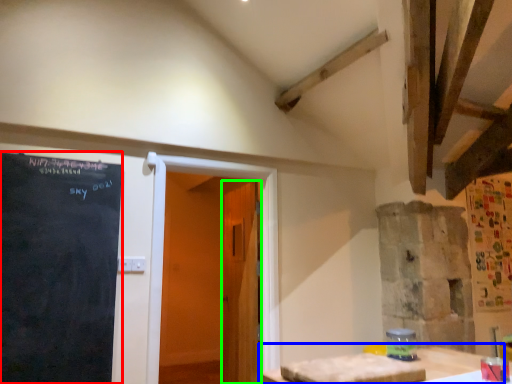
Question: Estimate the real-world distances between objects in this image. Which object is farther from blackboard (highlighted by a red box), table (highlighted by a blue box) or door (highlighted by a green box)?

Choices:
 (A) table
 (B) door

Answer: (A)